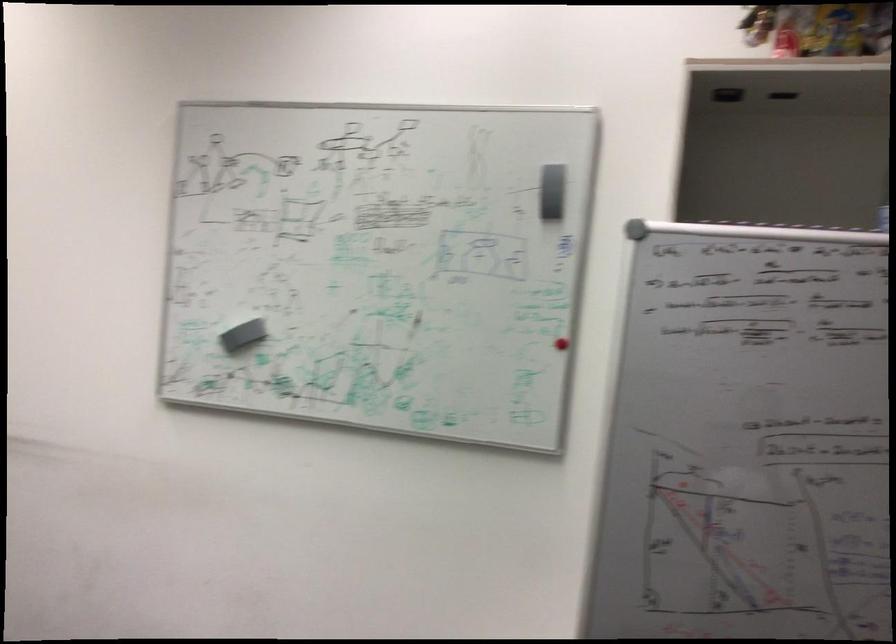
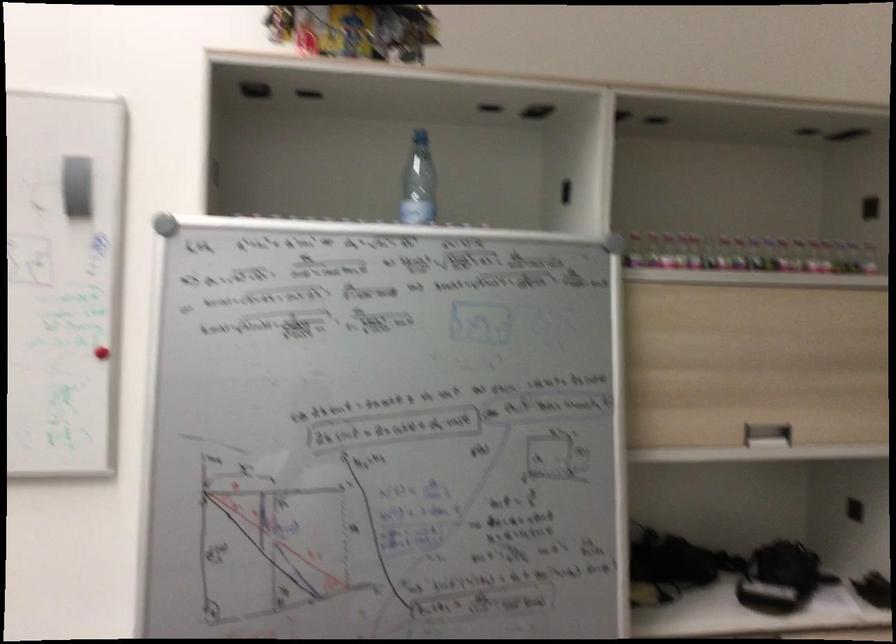
Question: The camera is either moving clockwise (left) or counter-clockwise (right) around the object. The first image is from the beginning of the video and the second image is from the end. Is the camera moving left or right when shooting the video?

Choices:
 (A) Left
 (B) Right

Answer: (A)